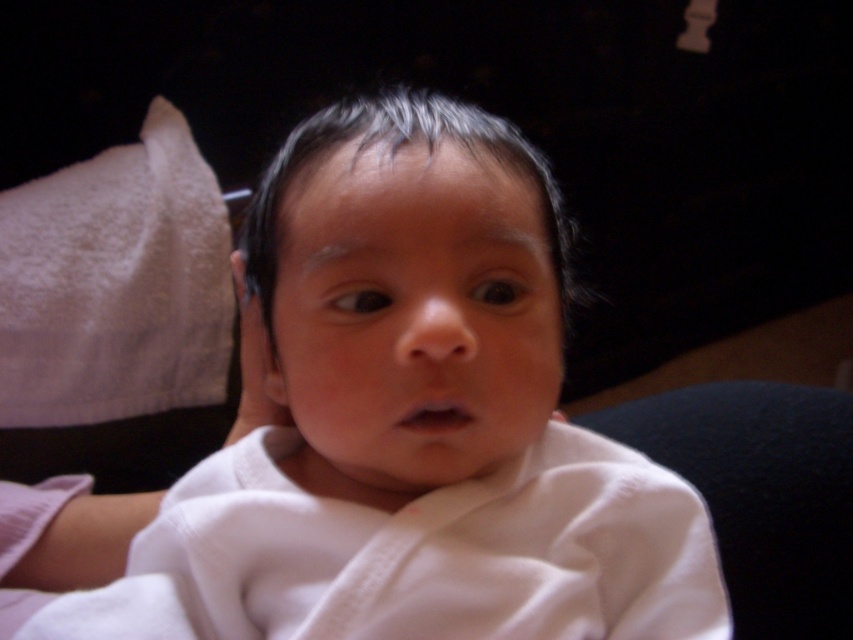
You are a photographer adjusting the lighting for a baby photo shoot. You notice two white soft cloths in the frame. Which one, the white soft cloth at center or the white soft cloth at left, is positioned closer to the camera?

The white soft cloth at center is closer to the viewer than the white soft cloth at left, so it is positioned closer to the camera.

A baby is wrapped in a white cloth with a dark hair that is slightly wet. There is a light fabric on the left and a dark couch on the right. If you were to draw a straight line between the two points marked as point [494,400], how long would the line be in inches?

The line between the two points marked as point [494,400] would be 15.49 inches long.